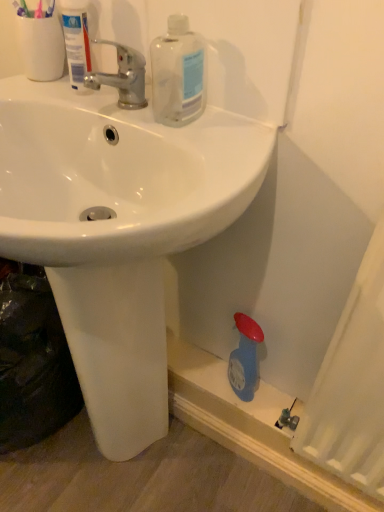
Question: In the image, is white glossy sink at center positioned in front of or behind transparent plastic bottle at upper center?

Choices:
 (A) front
 (B) behind

Answer: (A)

Question: Looking at their shapes, would you say white glossy sink at center is wider or thinner than transparent plastic bottle at upper center?

Choices:
 (A) thin
 (B) wide

Answer: (B)

Question: Based on their relative distances, which object is nearer to the white glossy sink at center?

Choices:
 (A) white plastic tube at upper left
 (B) transparent plastic bottle at upper center
 (C) chrome metallic faucet at upper center

Answer: (B)

Question: Estimate the real-world distances between objects in this image. Which object is closer to the white glossy sink at center?

Choices:
 (A) transparent plastic bottle at upper center
 (B) chrome metallic faucet at upper center
 (C) white plastic tube at upper left

Answer: (A)